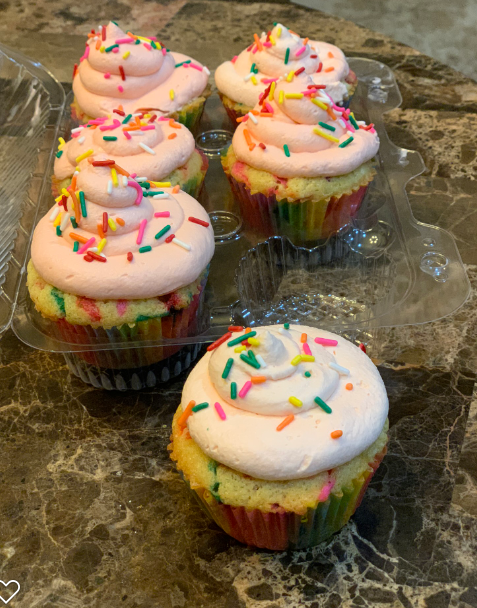
The width and height of the screenshot is (477, 608). I want to click on clear container, so click(x=29, y=95), click(x=25, y=170), click(x=3, y=256), click(x=291, y=288), click(x=372, y=288), click(x=405, y=165), click(x=368, y=89), click(x=408, y=271), click(x=42, y=330).